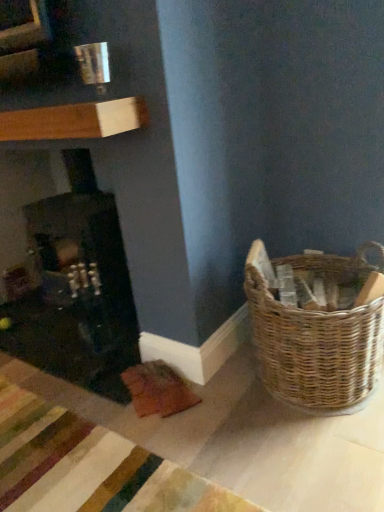
Identify the location of free location in front of matte black fireplace at left. The width and height of the screenshot is (384, 512). (61, 353).